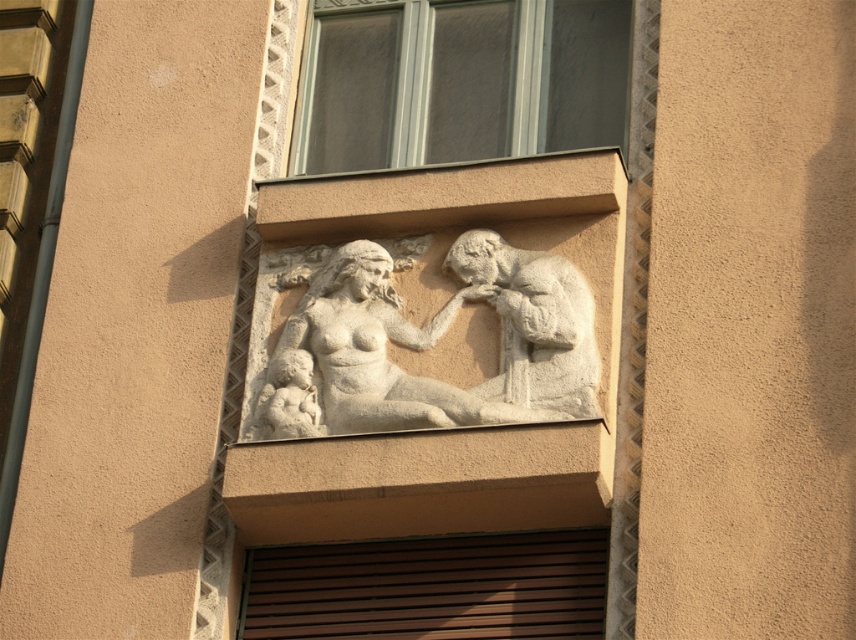
Which is in front, point (432, 90) or point (280, 284)?

Positioned in front is point (280, 284).

Is clear glass window at upper center to the right of white stone relief at center from the viewer's perspective?

Indeed, clear glass window at upper center is positioned on the right side of white stone relief at center.

Is point (504, 86) behind point (340, 371)?

Yes, point (504, 86) is behind point (340, 371).

The width and height of the screenshot is (856, 640). What are the coordinates of `clear glass window at upper center` in the screenshot? It's located at (461, 81).

Is clear glass window at upper center to the left of white stone sculpture at center from the viewer's perspective?

Yes, clear glass window at upper center is to the left of white stone sculpture at center.

Who is more distant from viewer, (462, 17) or (467, 253)?

Point (462, 17)

I want to click on clear glass window at upper center, so point(461,81).

Which is below, white stone relief at center or white stone sculpture at center?

white stone relief at center is lower down.

Who is higher up, white stone relief at center or white stone sculpture at center?

white stone sculpture at center is higher up.

Locate an element on the screen. The image size is (856, 640). white stone relief at center is located at coordinates (428, 342).